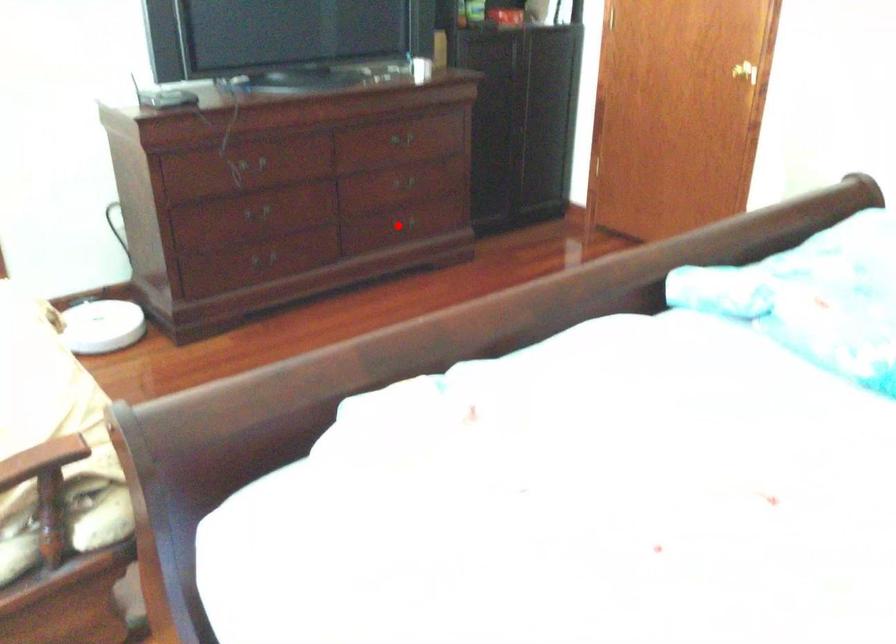
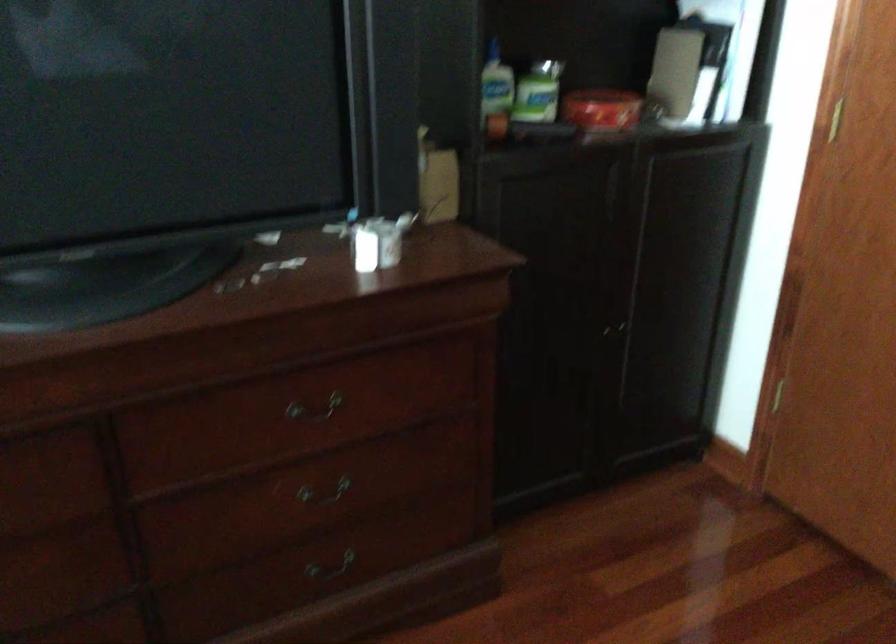
In the second image, find the point that corresponds to the highlighted location in the first image.

(330, 567)